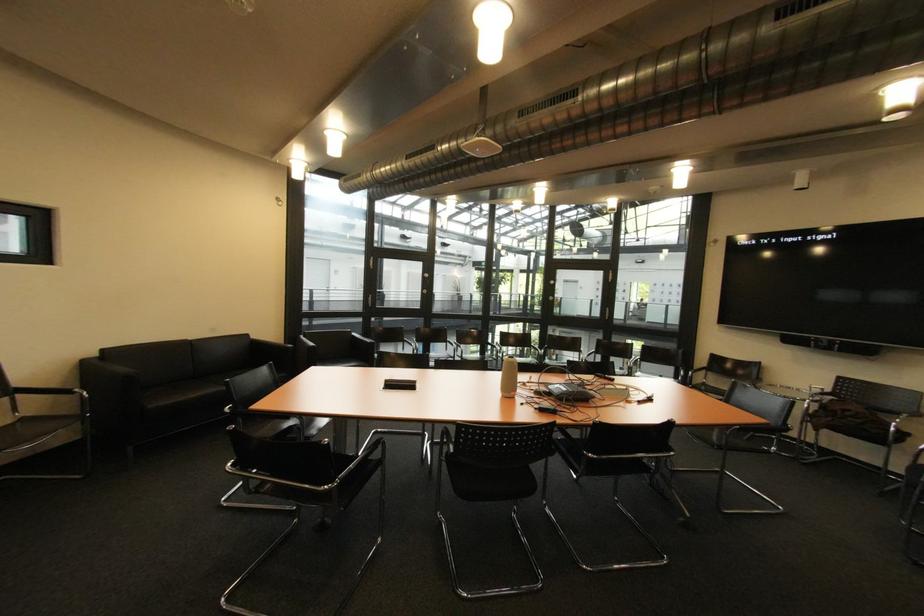
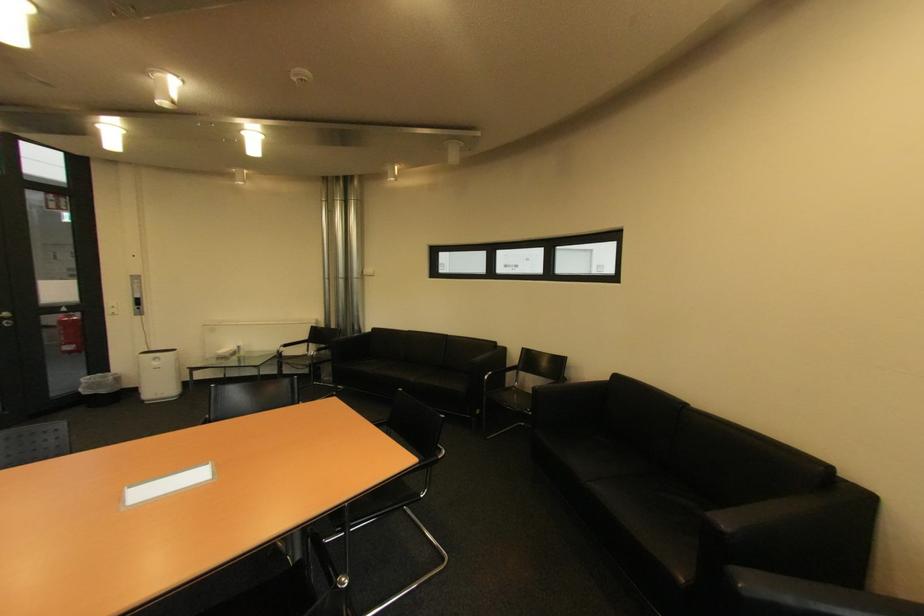
Where in the second image is the point corresponding to (111,352) from the first image?

(625, 378)